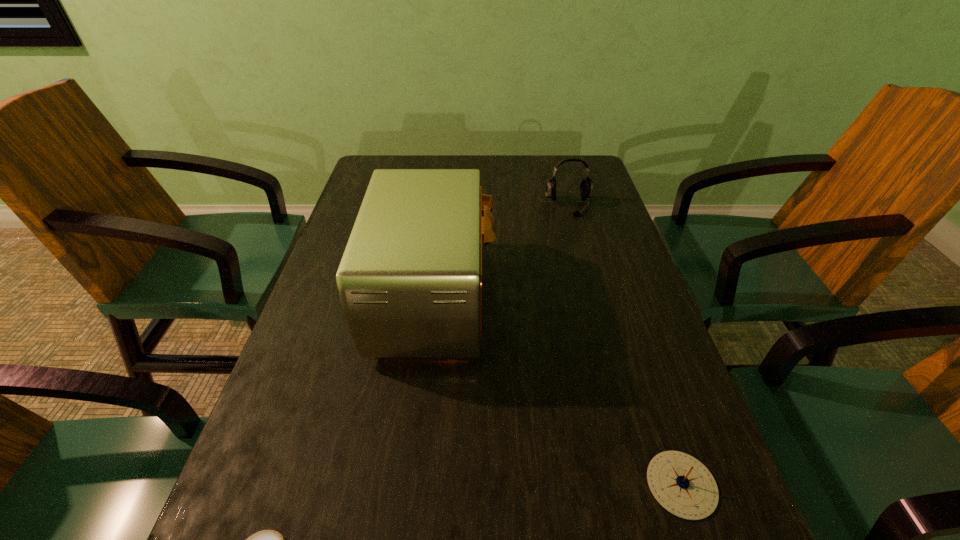
I want to click on free area in between the farthest object and the toaster oven, so coord(502,252).

In order to click on blank region between the taller compass and the headset in this screenshot , I will do `click(625, 345)`.

At what (x,y) coordinates should I click in order to perform the action: click on vacant space in between the third farthest object and the second farthest object. Please return your answer as a coordinate pair (x, y). The image size is (960, 540). Looking at the image, I should click on (559, 391).

Where is `object that can be found as the second closest to the second object from left to right`? This screenshot has width=960, height=540. object that can be found as the second closest to the second object from left to right is located at coordinates (266, 539).

This screenshot has width=960, height=540. Find the location of `the third closest object relative to the second shortest object`. the third closest object relative to the second shortest object is located at coordinates (586, 187).

This screenshot has height=540, width=960. I want to click on vacant area that satisfies the following two spatial constraints: 1. with the microphone on the side of the right compass; 2. on the left side of the headset, so click(644, 484).

This screenshot has width=960, height=540. I want to click on vacant region that satisfies the following two spatial constraints: 1. with the microphone on the side of the second tallest object; 2. on the door side of the tallest object, so click(593, 297).

The height and width of the screenshot is (540, 960). Identify the location of blank space that satisfies the following two spatial constraints: 1. with the microphone on the side of the farthest object; 2. on the door side of the third nearest object. (593, 297).

Locate an element on the screen. free location that satisfies the following two spatial constraints: 1. on the door side of the tallest object; 2. on the back side of the farther compass is located at coordinates (416, 484).

Locate an element on the screen. free space that satisfies the following two spatial constraints: 1. with the microphone on the side of the farther compass; 2. on the right side of the third shortest object is located at coordinates (644, 484).